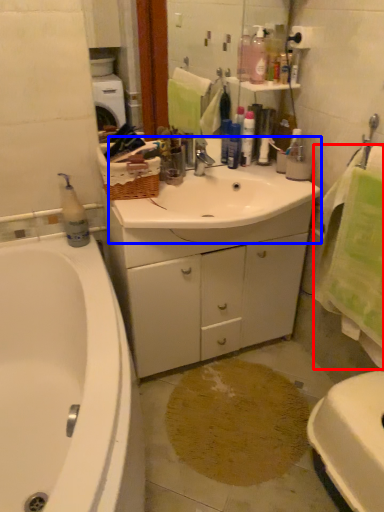
Question: Which point is closer to the camera, bath towel (highlighted by a red box) or sink (highlighted by a blue box)?

Choices:
 (A) bath towel
 (B) sink

Answer: (A)